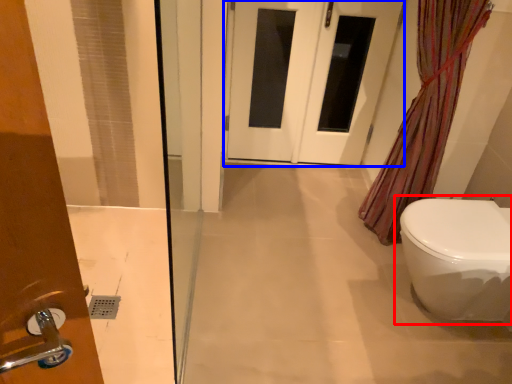
Question: Which point is further to the camera, toilet (highlighted by a red box) or door (highlighted by a blue box)?

Choices:
 (A) toilet
 (B) door

Answer: (B)